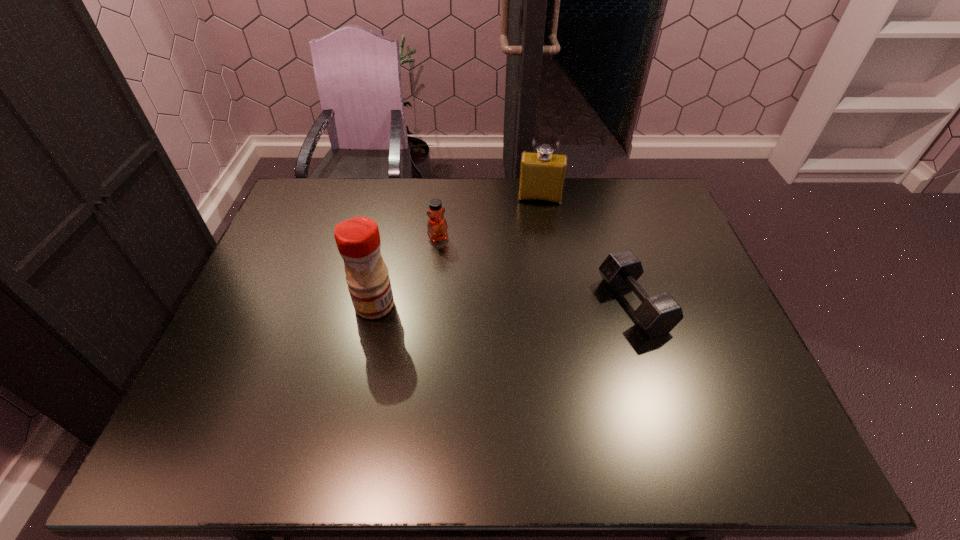
Locate an element on the screen. vacant area that lies between the leftmost object and the dumbbell is located at coordinates (504, 305).

This screenshot has width=960, height=540. What are the coordinates of `free space between the second object from left to right and the dumbbell` in the screenshot? It's located at (536, 271).

This screenshot has width=960, height=540. I want to click on vacant space that is in between the condiment and the third object from left to right, so click(457, 252).

Find the location of a particular element. free space between the condiment and the third object from right to left is located at coordinates (406, 272).

This screenshot has width=960, height=540. I want to click on object that is the third nearest to the leftmost object, so click(657, 315).

At what (x,y) coordinates should I click in order to perform the action: click on object that is the closest to the leftmost object. Please return your answer as a coordinate pair (x, y). This screenshot has height=540, width=960. Looking at the image, I should click on (437, 226).

Identify the location of vacant space that satisfies the following two spatial constraints: 1. on the back side of the farthest object; 2. on the left side of the honey. (442, 198).

You are a GUI agent. You are given a task and a screenshot of the screen. Output one action in this format:
    pyautogui.click(x=<x>, y=<y>)
    Task: Click on the vacant space that satisfies the following two spatial constraints: 1. on the back side of the farthest object; 2. on the left side of the second shortest object
    
    Given the screenshot: What is the action you would take?
    pyautogui.click(x=442, y=198)

Locate an element on the screen. vacant region that satisfies the following two spatial constraints: 1. on the front side of the second shortest object; 2. on the left side of the shortest object is located at coordinates (431, 305).